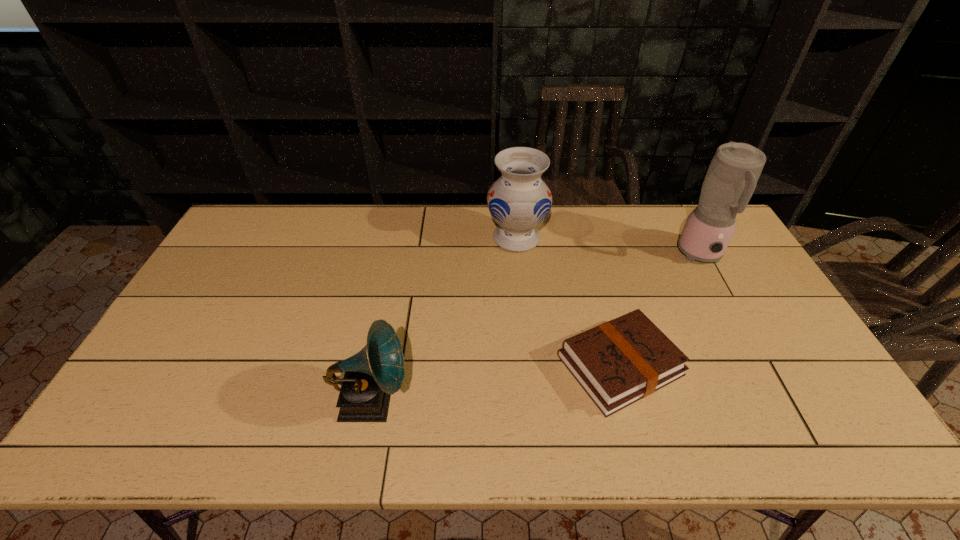
Find the location of a particular element. The image size is (960, 540). food processor is located at coordinates (732, 176).

Locate an element on the screen. the rightmost object is located at coordinates (732, 176).

This screenshot has width=960, height=540. Identify the location of vase. (519, 201).

At what (x,y) coordinates should I click in order to perform the action: click on the third tallest object. Please return your answer as a coordinate pair (x, y). This screenshot has width=960, height=540. Looking at the image, I should click on tap(372, 375).

Locate an element on the screen. The image size is (960, 540). phonograph_record is located at coordinates (372, 375).

The image size is (960, 540). What are the coordinates of `hardback book` in the screenshot? It's located at pyautogui.click(x=621, y=361).

At what (x,y) coordinates should I click in order to perform the action: click on free space located on the base of the food processor near the control knob. Please return your answer as a coordinate pair (x, y). Image resolution: width=960 pixels, height=540 pixels. Looking at the image, I should click on (730, 307).

Find the location of a particular element. free region located 0.260m on the right of the vase is located at coordinates (622, 238).

Where is `free region located 0.090m from the horn of the leftmost object`? This screenshot has height=540, width=960. free region located 0.090m from the horn of the leftmost object is located at coordinates [x=445, y=401].

You are a GUI agent. You are given a task and a screenshot of the screen. Output one action in this format:
    pyautogui.click(x=<x>, y=<y>)
    Task: Click on the free space located on the back of the shortest object
    Image resolution: width=960 pixels, height=540 pixels.
    Given the screenshot: What is the action you would take?
    pyautogui.click(x=594, y=271)